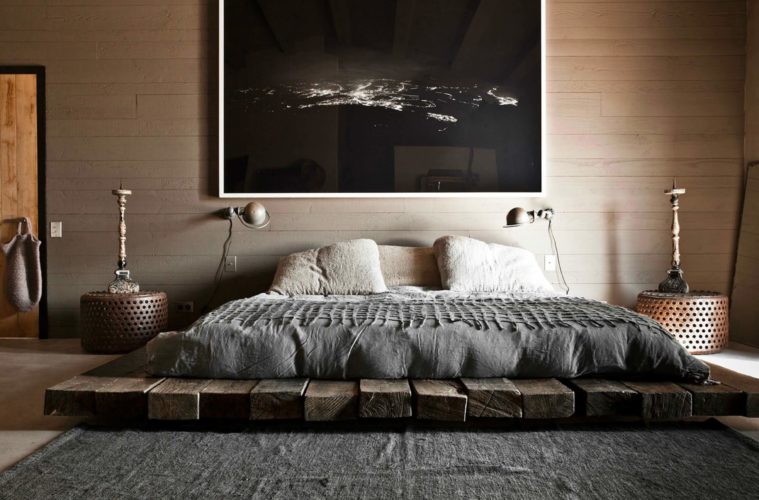
Image resolution: width=759 pixels, height=500 pixels. In order to click on bed in this screenshot , I will do `click(442, 325)`.